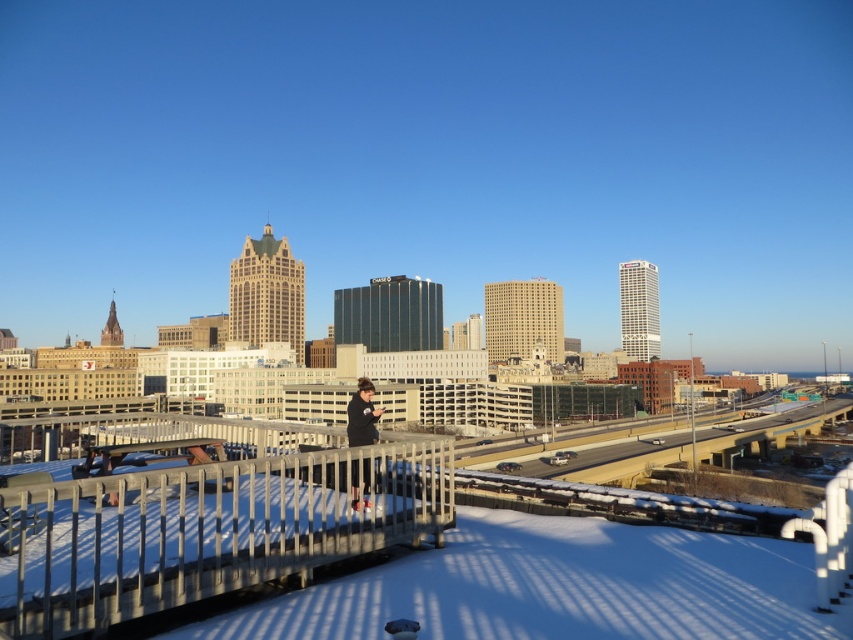
You are standing on the snow covered rooftop and want to take a photo of the city. The metallic gray railing at lower center and the black fabric at center are in your view. Which object is closer to you?

The metallic gray railing at lower center is closer to you since it is in front of the black fabric at center.